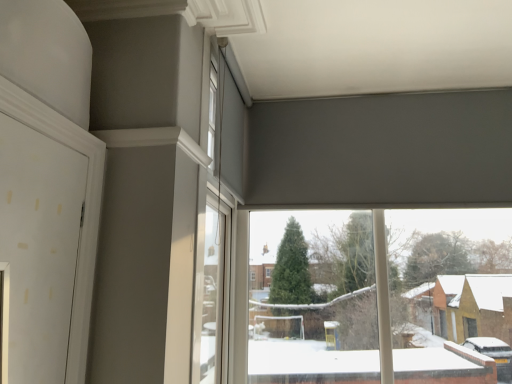
What is the approximate height of white matte window at upper center, arranged as the 2th window when viewed from the right?

It is 27.33 inches.

This screenshot has height=384, width=512. Describe the element at coordinates (228, 126) in the screenshot. I see `white matte window at upper center, arranged as the 2th window when viewed from the right` at that location.

Locate an element on the screen. The image size is (512, 384). white matte window at upper center, the first window positioned from the top is located at coordinates (228, 126).

In order to face transparent glass window at center, the 1th window when ordered from bottom to top, should I rotate leftwards or rightwards?

Turn right by 15.708 degrees to look at transparent glass window at center, the 1th window when ordered from bottom to top.

Describe the element at coordinates (314, 307) in the screenshot. This screenshot has width=512, height=384. I see `transparent glass window at center, the 1th window when ordered from bottom to top` at that location.

This screenshot has width=512, height=384. What are the coordinates of `transparent glass window at center, the 1th window when ordered from bottom to top` in the screenshot? It's located at (314, 307).

Identify the location of white matte window at upper center, the 2th window from the bottom. Image resolution: width=512 pixels, height=384 pixels. (228, 126).

Does transparent glass window at center, acting as the 1th window starting from the right, appear on the left side of white matte window at upper center, which ranks as the first window in left-to-right order?

No.

Which is in front, transparent glass window at center, the 1th window when ordered from bottom to top, or white matte window at upper center, the 2th window from the bottom?

Positioned in front is white matte window at upper center, the 2th window from the bottom.

Is point (396, 371) closer to viewer compared to point (228, 165)?

No, (396, 371) is further to viewer.

From the image's perspective, between transparent glass window at center, the 1th window when ordered from bottom to top, and white matte window at upper center, the 2th window from the bottom, who is located below?

transparent glass window at center, the 1th window when ordered from bottom to top, is shown below in the image.

From a real-world perspective, which is physically below, transparent glass window at center, acting as the 1th window starting from the right, or white matte window at upper center, which ranks as the first window in left-to-right order?

In real-world perspective, transparent glass window at center, acting as the 1th window starting from the right, is lower.

Which of these two, transparent glass window at center, acting as the 1th window starting from the right, or white matte window at upper center, the first window positioned from the top, is wider?

With larger width is transparent glass window at center, acting as the 1th window starting from the right.

Which of these two, transparent glass window at center, marked as the second window in a top-to-bottom arrangement, or white matte window at upper center, the 2th window from the bottom, stands taller?

transparent glass window at center, marked as the second window in a top-to-bottom arrangement.

Is transparent glass window at center, the 1th window when ordered from bottom to top, smaller than white matte window at upper center, arranged as the 2th window when viewed from the right?

No, transparent glass window at center, the 1th window when ordered from bottom to top, is not smaller than white matte window at upper center, arranged as the 2th window when viewed from the right.

Consider the image. Is transparent glass window at center, the 1th window when ordered from bottom to top, completely or partially outside of white matte window at upper center, which ranks as the first window in left-to-right order?

Yes, transparent glass window at center, the 1th window when ordered from bottom to top, is located beyond the bounds of white matte window at upper center, which ranks as the first window in left-to-right order.

Is transparent glass window at center, which is counted as the second window, starting from the left, positioned far away from white matte window at upper center, the first window positioned from the top?

transparent glass window at center, which is counted as the second window, starting from the left, is actually quite close to white matte window at upper center, the first window positioned from the top.

Is transparent glass window at center, the 1th window when ordered from bottom to top, aimed at white matte window at upper center, the first window positioned from the top?

No, transparent glass window at center, the 1th window when ordered from bottom to top, is not aimed at white matte window at upper center, the first window positioned from the top.

At what (x,y) coordinates should I click in order to perform the action: click on window located below the white matte window at upper center, the 2th window from the bottom (from the image's perspective). Please return your answer as a coordinate pair (x, y). Looking at the image, I should click on (314, 307).

Which is more to the right, white matte window at upper center, arranged as the 2th window when viewed from the right, or transparent glass window at center, the 1th window when ordered from bottom to top?

transparent glass window at center, the 1th window when ordered from bottom to top.

From the picture: Relative to transparent glass window at center, the 1th window when ordered from bottom to top, is white matte window at upper center, the first window positioned from the top, in front or behind?

white matte window at upper center, the first window positioned from the top, is in front of transparent glass window at center, the 1th window when ordered from bottom to top.

Considering the positions of point (227, 136) and point (334, 258), is point (227, 136) closer or farther from the camera than point (334, 258)?

Point (227, 136) appears to be closer to the viewer than point (334, 258).

From the image's perspective, is white matte window at upper center, the 2th window from the bottom, on transparent glass window at center, the 1th window when ordered from bottom to top?

Correct, white matte window at upper center, the 2th window from the bottom, appears higher than transparent glass window at center, the 1th window when ordered from bottom to top, in the image.

From a real-world perspective, who is located lower, white matte window at upper center, arranged as the 2th window when viewed from the right, or transparent glass window at center, marked as the second window in a top-to-bottom arrangement?

From a 3D spatial view, transparent glass window at center, marked as the second window in a top-to-bottom arrangement, is below.

Looking at this image, between white matte window at upper center, which ranks as the first window in left-to-right order, and transparent glass window at center, the 1th window when ordered from bottom to top, which one has smaller width?

white matte window at upper center, which ranks as the first window in left-to-right order, is thinner.

Can you confirm if white matte window at upper center, which ranks as the first window in left-to-right order, is taller than transparent glass window at center, acting as the 1th window starting from the right?

In fact, white matte window at upper center, which ranks as the first window in left-to-right order, may be shorter than transparent glass window at center, acting as the 1th window starting from the right.

From the picture: Who is smaller, white matte window at upper center, the first window positioned from the top, or transparent glass window at center, the 1th window when ordered from bottom to top?

white matte window at upper center, the first window positioned from the top, is smaller.

Is white matte window at upper center, the 2th window from the bottom, completely or partially outside of transparent glass window at center, marked as the second window in a top-to-bottom arrangement?

Yes, white matte window at upper center, the 2th window from the bottom, is located beyond the bounds of transparent glass window at center, marked as the second window in a top-to-bottom arrangement.

Is white matte window at upper center, the 2th window from the bottom, far away from transparent glass window at center, marked as the second window in a top-to-bottom arrangement?

white matte window at upper center, the 2th window from the bottom, is near transparent glass window at center, marked as the second window in a top-to-bottom arrangement, not far away.

Could you tell me if white matte window at upper center, the 2th window from the bottom, is turned towards transparent glass window at center, which is counted as the second window, starting from the left?

No, white matte window at upper center, the 2th window from the bottom, is not aimed at transparent glass window at center, which is counted as the second window, starting from the left.

How different are the orientations of white matte window at upper center, which ranks as the first window in left-to-right order, and transparent glass window at center, the 1th window when ordered from bottom to top, in degrees?

They differ by 89 degrees in their facing directions.

Where is `window in front of the transparent glass window at center, acting as the 1th window starting from the right`? Image resolution: width=512 pixels, height=384 pixels. window in front of the transparent glass window at center, acting as the 1th window starting from the right is located at coordinates (228, 126).

Where is `window lying below the white matte window at upper center, the 2th window from the bottom (from the image's perspective)`? window lying below the white matte window at upper center, the 2th window from the bottom (from the image's perspective) is located at coordinates (314, 307).

Image resolution: width=512 pixels, height=384 pixels. Find the location of `window lying above the transparent glass window at center, the 1th window when ordered from bottom to top (from the image's perspective)`. window lying above the transparent glass window at center, the 1th window when ordered from bottom to top (from the image's perspective) is located at coordinates (228, 126).